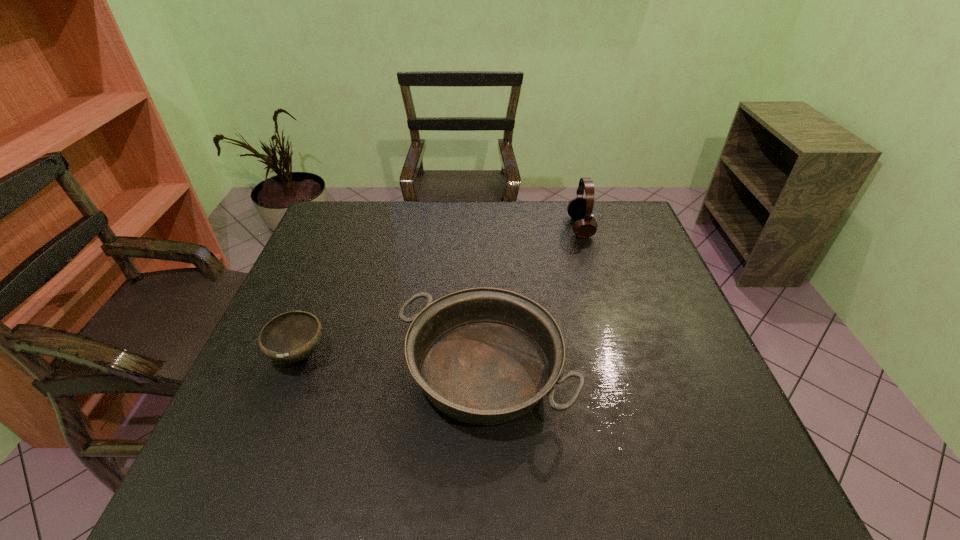
Find the location of a particular element. Image resolution: width=960 pixels, height=540 pixels. free space located 0.190m on the right of the bowl is located at coordinates (408, 355).

Find the location of `object at the far edge`. object at the far edge is located at coordinates (580, 209).

Image resolution: width=960 pixels, height=540 pixels. I want to click on object at the left edge, so click(x=290, y=337).

The height and width of the screenshot is (540, 960). Find the location of `object that is positioned at the right edge`. object that is positioned at the right edge is located at coordinates (580, 209).

Where is `object at the far right corner`? The image size is (960, 540). object at the far right corner is located at coordinates (580, 209).

In the image, there is a desktop. In order to click on vacant space at the far edge in this screenshot , I will do `click(412, 214)`.

Locate an element on the screen. The height and width of the screenshot is (540, 960). vacant space at the near edge of the desktop is located at coordinates (372, 459).

In the image, there is a desktop. At what (x,y) coordinates should I click in order to perform the action: click on vacant space at the left edge. Please return your answer as a coordinate pair (x, y). This screenshot has width=960, height=540. Looking at the image, I should click on (310, 380).

The image size is (960, 540). I want to click on vacant space at the right edge of the desktop, so (x=618, y=295).

At what (x,y) coordinates should I click in order to perform the action: click on vacant space at the near left corner of the desktop. Please return your answer as a coordinate pair (x, y). This screenshot has height=540, width=960. Looking at the image, I should click on (269, 501).